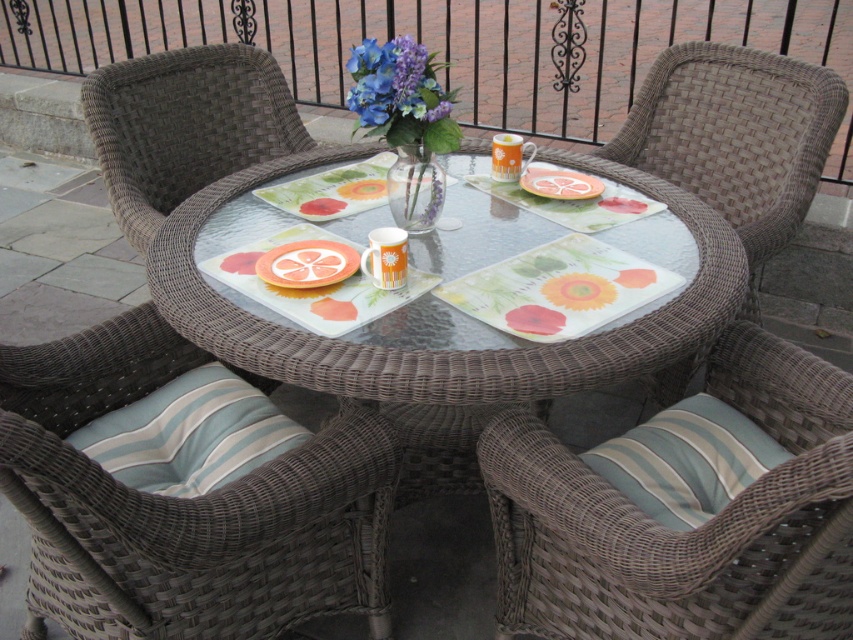
Question: Observing the image, what is the correct spatial positioning of metallic wrought iron rail at upper center in reference to orange glossy platter at center?

Choices:
 (A) right
 (B) left

Answer: (B)

Question: Is woven rattan chair at lower left positioned at the back of woven brown chair at upper right?

Choices:
 (A) yes
 (B) no

Answer: (B)

Question: Which of the following is the farthest from the observer?

Choices:
 (A) transparent glass table at center
 (B) translucent glass platter at center
 (C) brown wicker chair at upper left
 (D) matte glass vase at center

Answer: (C)

Question: Which point is closer to the camera?

Choices:
 (A) (544, 170)
 (B) (486, 467)

Answer: (B)

Question: Among these points, which one is farthest from the camera?

Choices:
 (A) (154, 35)
 (B) (614, 461)
 (C) (317, 257)

Answer: (A)

Question: Is metallic wrought iron rail at upper center smaller than blue striped cushion at lower right?

Choices:
 (A) no
 (B) yes

Answer: (A)